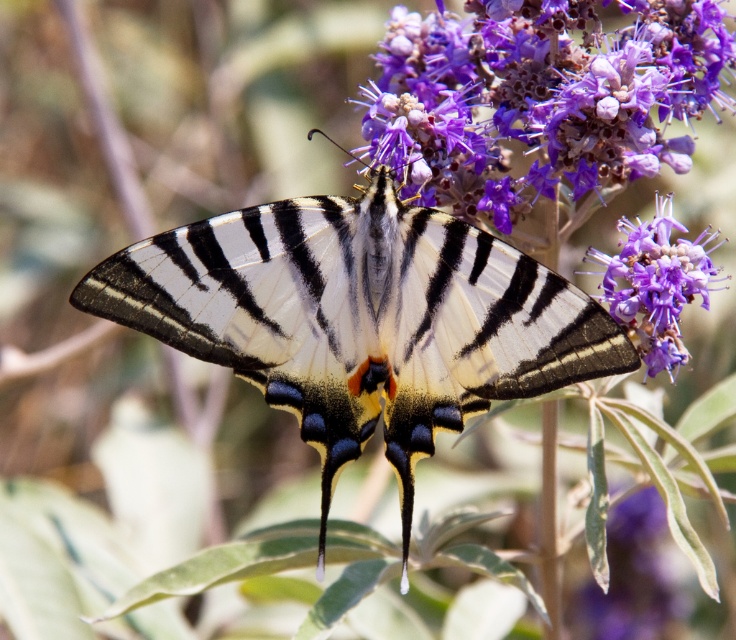
Question: In this image, where is shiny metallic butterfly at center located relative to purple fuzzy flower at center?

Choices:
 (A) left
 (B) right

Answer: (A)

Question: Among these objects, which one is nearest to the camera?

Choices:
 (A) shiny metallic butterfly at center
 (B) purple matte flower at upper center
 (C) purple fuzzy flower at center

Answer: (A)

Question: From the image, what is the correct spatial relationship of shiny metallic butterfly at center in relation to purple matte flower at upper center?

Choices:
 (A) left
 (B) right

Answer: (A)

Question: Can you confirm if purple matte flower at upper center is positioned below purple fuzzy flower at center?

Choices:
 (A) yes
 (B) no

Answer: (B)

Question: Estimate the real-world distances between objects in this image. Which object is closer to the purple fuzzy flower at center?

Choices:
 (A) purple matte flower at upper center
 (B) shiny metallic butterfly at center

Answer: (A)

Question: Which is farther from the purple fuzzy flower at center?

Choices:
 (A) shiny metallic butterfly at center
 (B) purple matte flower at upper center

Answer: (A)